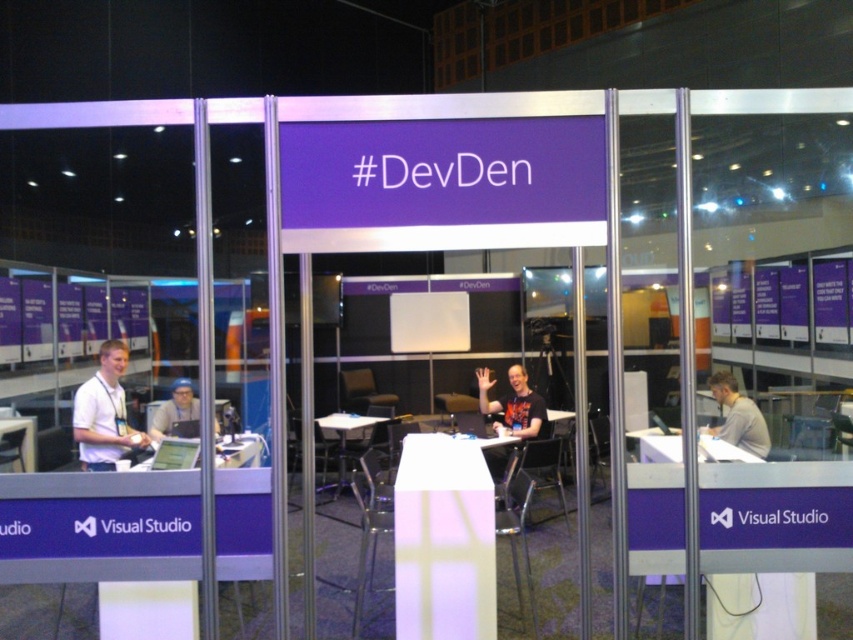
Question: Is white matte shirt at left smaller than white plastic table at lower left?

Choices:
 (A) yes
 (B) no

Answer: (B)

Question: Is gray matte shirt at right thinner than matte black laptop at left?

Choices:
 (A) yes
 (B) no

Answer: (A)

Question: Can you confirm if gray matte shirt at right is positioned below white plastic table at lower left?

Choices:
 (A) no
 (B) yes

Answer: (A)

Question: Estimate the real-world distances between objects in this image. Which object is closer to the white plastic table at lower left?

Choices:
 (A) matte black laptop at left
 (B) black t-shirt at center
 (C) gray matte shirt at right

Answer: (A)

Question: Which point is farther to the camera?

Choices:
 (A) gray matte shirt at right
 (B) white plastic table at center
 (C) black t-shirt at center
 (D) white matte shirt at left

Answer: (B)

Question: Which point appears farthest from the camera in this image?

Choices:
 (A) (35, 461)
 (B) (166, 413)

Answer: (A)